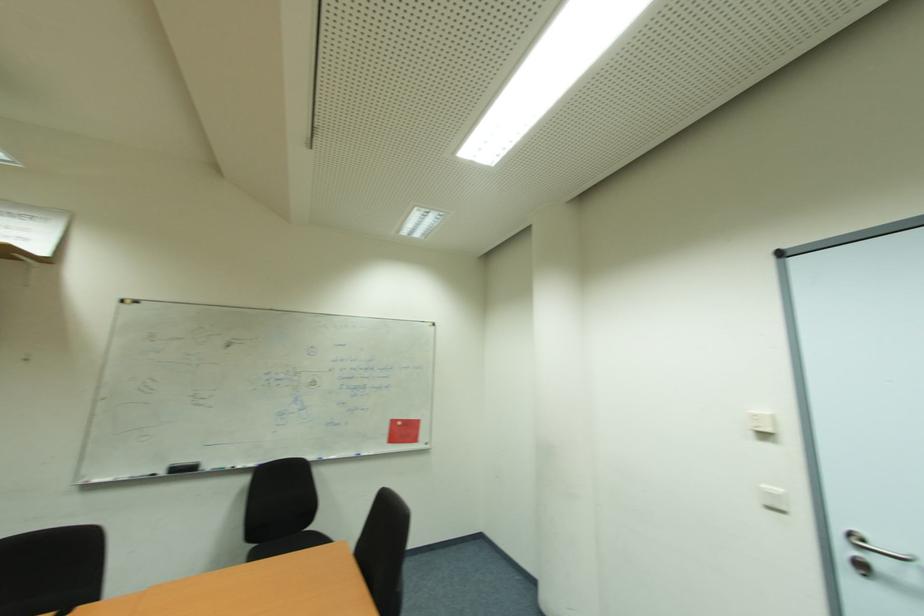
Find where to sit the chair sitting surface. Please return your answer as a coordinate pair (x, y).

(285, 545)